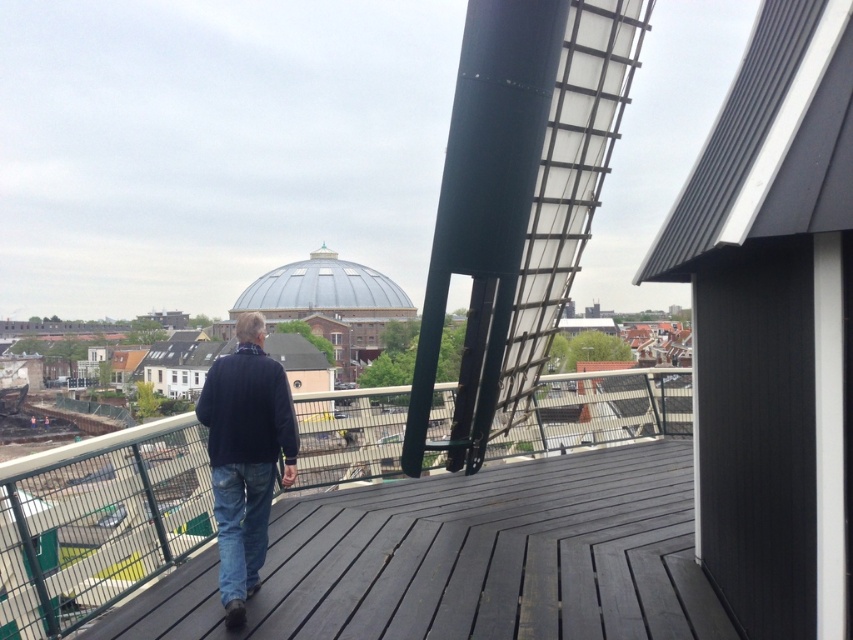
Question: Does dark wood deck at center lie in front of metallic silver dome at center?

Choices:
 (A) yes
 (B) no

Answer: (A)

Question: Is dark wood deck at center above dark blue sweater at center?

Choices:
 (A) no
 (B) yes

Answer: (A)

Question: Among these points, which one is nearest to the camera?

Choices:
 (A) (663, 588)
 (B) (207, 397)
 (C) (264, 515)
 (D) (352, 300)

Answer: (A)

Question: Which object is farther from the camera taking this photo?

Choices:
 (A) metallic silver dome at center
 (B) dark blue sweater at center
 (C) blue denim jeans at center

Answer: (A)

Question: Which object appears closest to the camera in this image?

Choices:
 (A) blue denim jeans at center
 (B) metallic silver dome at center
 (C) dark wood deck at center

Answer: (C)

Question: Is the position of metallic silver dome at center more distant than that of blue denim jeans at center?

Choices:
 (A) no
 (B) yes

Answer: (B)